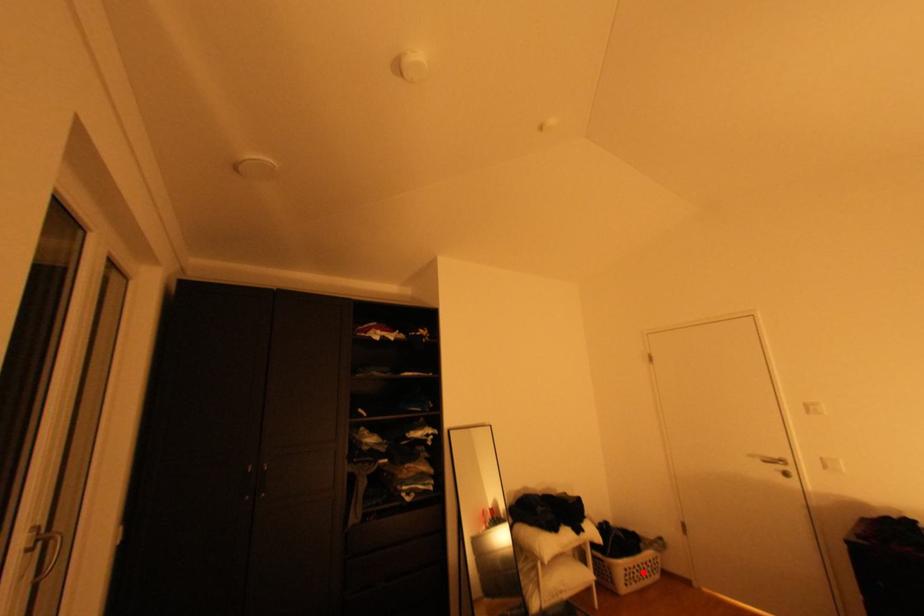
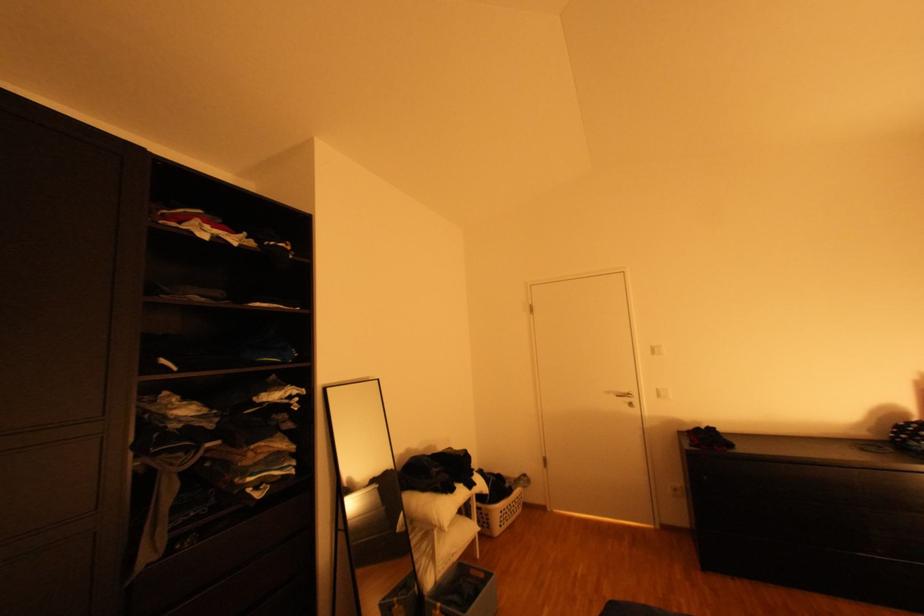
Locate, in the second image, the point that corresponds to the highlighted location in the first image.

(516, 513)